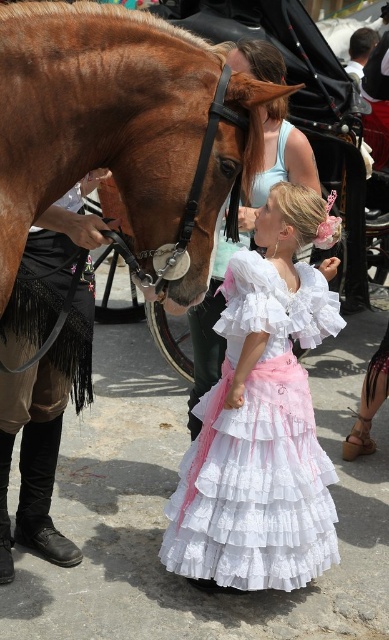
Question: Can you confirm if white lace dress at center is smaller than matte white blouse at center?

Choices:
 (A) yes
 (B) no

Answer: (B)

Question: Among these objects, which one is farthest from the camera?

Choices:
 (A) matte white blouse at center
 (B) white lace dress at center

Answer: (A)

Question: Observing the image, what is the correct spatial positioning of shiny brown horse at left in reference to matte white blouse at center?

Choices:
 (A) right
 (B) left

Answer: (B)

Question: Estimate the real-world distances between objects in this image. Which object is closer to the matte white blouse at center?

Choices:
 (A) white lace dress at center
 (B) shiny brown horse at left

Answer: (A)

Question: Is shiny brown horse at left closer to the viewer compared to white lace dress at center?

Choices:
 (A) no
 (B) yes

Answer: (B)

Question: Which point is closer to the camera?

Choices:
 (A) (257, 445)
 (B) (203, 260)

Answer: (B)